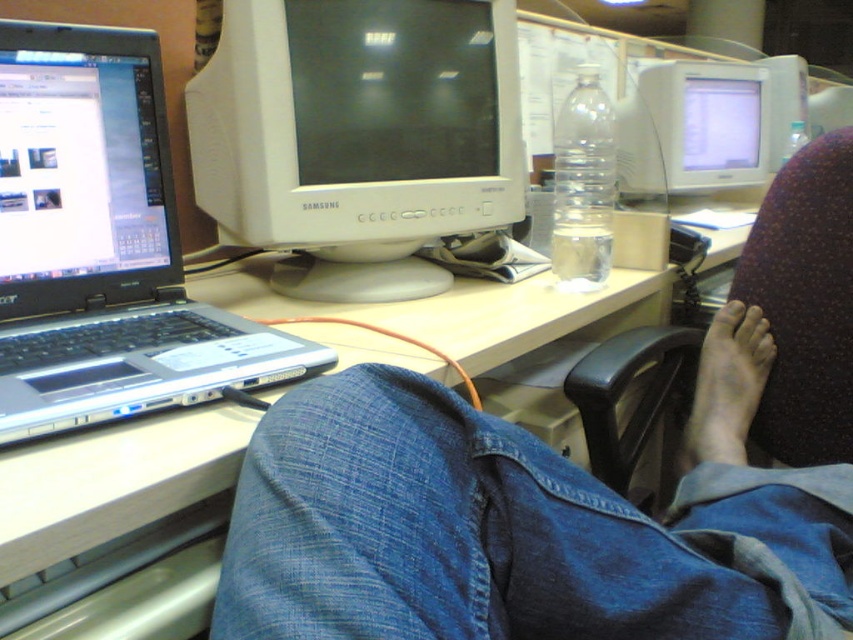
You are organizing a desk and need to place a new keyboard. The desk has a Samsung CRT monitor at center and a silver laptop to its left. Where should you place the new keyboard so it is closest to the Samsung CRT monitor but not overlapping with the silver laptop? Use the coordinate system where the bottom left corner is the origin. The Samsung CRT monitor is at point (358, 136). The silver laptop is to the left of the monitor.

The new keyboard should be placed near the Samsung CRT monitor at center, specifically at point (358, 136), ensuring it is closest to the monitor while avoiding the silver laptop located to its left.

You are organizing the desk and want to place a new document organizer between the white plastic monitor at center and the white glossy computer monitor at upper right. Based on their positions, can you place it there?

The white plastic monitor at center is in front of the white glossy computer monitor at upper right, so there is space between them to place the document organizer.

You are standing at the edge of the desk and want to place a small object on the desk. You have two points to choose from. The first point is point (x=810, y=502) and the second point is point (x=215, y=333). Which point is closer to you?

Point (x=810, y=502) is in front of point (x=215, y=333), so placing the object there would be closer to you.